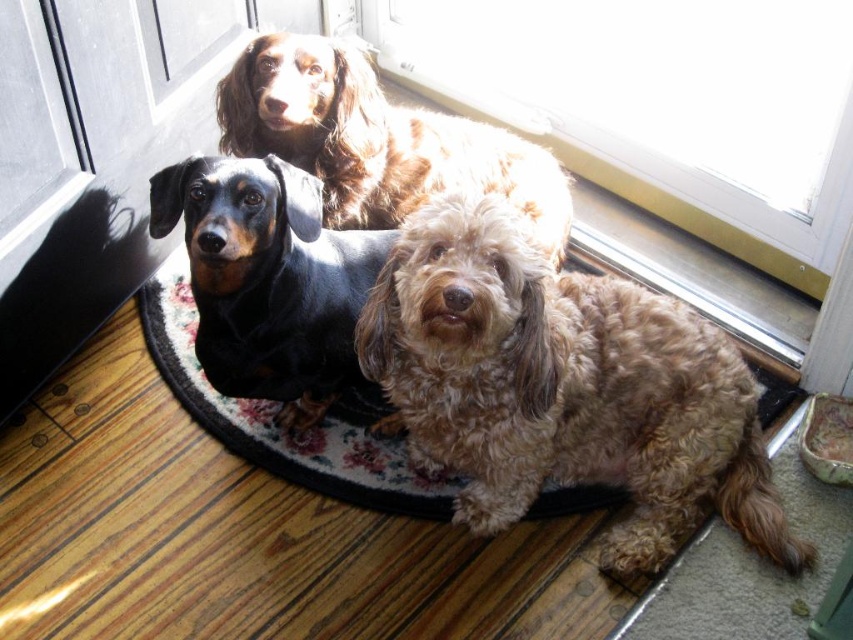
Which is in front, point (482, 412) or point (354, 81)?

Point (482, 412) is in front.

Who is taller, fuzzy brown dog at center or shiny brown fur at upper center?

fuzzy brown dog at center

Between point (489, 269) and point (386, 136), which one is positioned behind?

The point (386, 136) is behind.

I want to click on fuzzy brown dog at center, so click(563, 387).

Between shiny brown fur at upper center and fluffy carpet at center, which one is positioned lower?

fluffy carpet at center is below.

Does shiny brown fur at upper center have a lesser width compared to fluffy carpet at center?

Yes, shiny brown fur at upper center is thinner than fluffy carpet at center.

Identify the location of shiny brown fur at upper center. This screenshot has height=640, width=853. tap(376, 140).

Identify the location of shiny brown fur at upper center. This screenshot has height=640, width=853. (376, 140).

Can you confirm if black shiny dachshund at center is wider than shiny brown fur at upper center?

No, black shiny dachshund at center is not wider than shiny brown fur at upper center.

Can you confirm if black shiny dachshund at center is positioned to the left of shiny brown fur at upper center?

Yes, black shiny dachshund at center is to the left of shiny brown fur at upper center.

Which is behind, point (347, 232) or point (299, 84)?

Positioned behind is point (347, 232).

The width and height of the screenshot is (853, 640). I want to click on black shiny dachshund at center, so click(x=268, y=280).